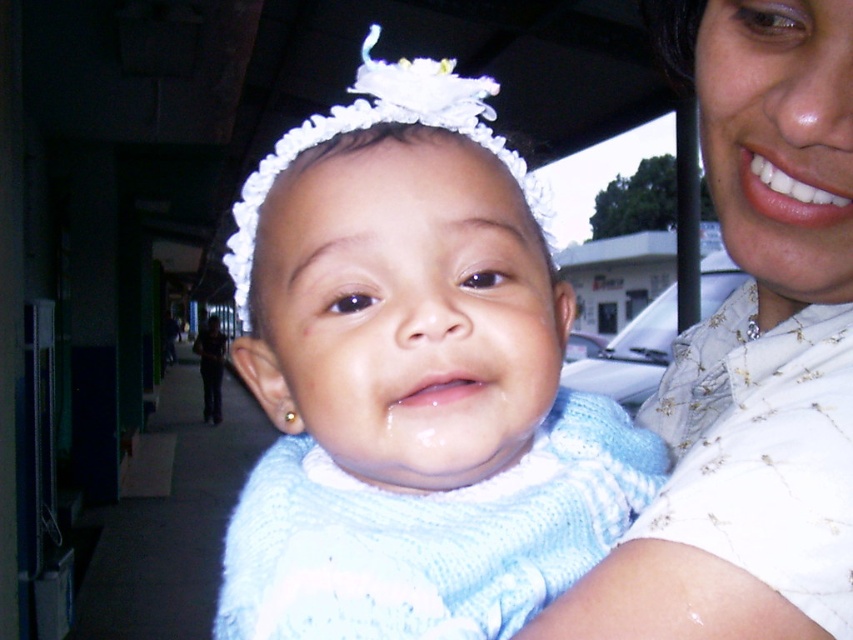
Question: Which of the following is the farthest from the observer?

Choices:
 (A) (364, 440)
 (B) (712, 534)

Answer: (B)

Question: Is light blue knitted sweater at center in front of white quilted shirt at upper right?

Choices:
 (A) yes
 (B) no

Answer: (A)

Question: From the image, what is the correct spatial relationship of light blue knitted sweater at center in relation to white quilted shirt at upper right?

Choices:
 (A) above
 (B) below

Answer: (B)

Question: Which object appears closest to the camera in this image?

Choices:
 (A) white quilted shirt at upper right
 (B) light blue knitted sweater at center

Answer: (B)

Question: Where is light blue knitted sweater at center located in relation to white quilted shirt at upper right in the image?

Choices:
 (A) left
 (B) right

Answer: (A)

Question: Which point appears farthest from the camera in this image?

Choices:
 (A) (511, 509)
 (B) (793, 212)

Answer: (A)